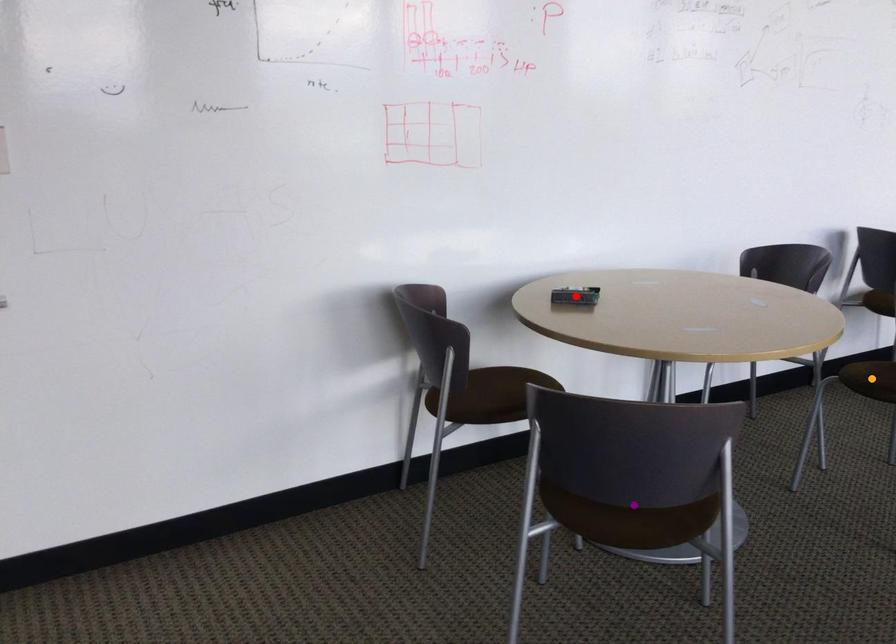
Order these from nearest to farthest:
red point, purple point, orange point

red point < orange point < purple point